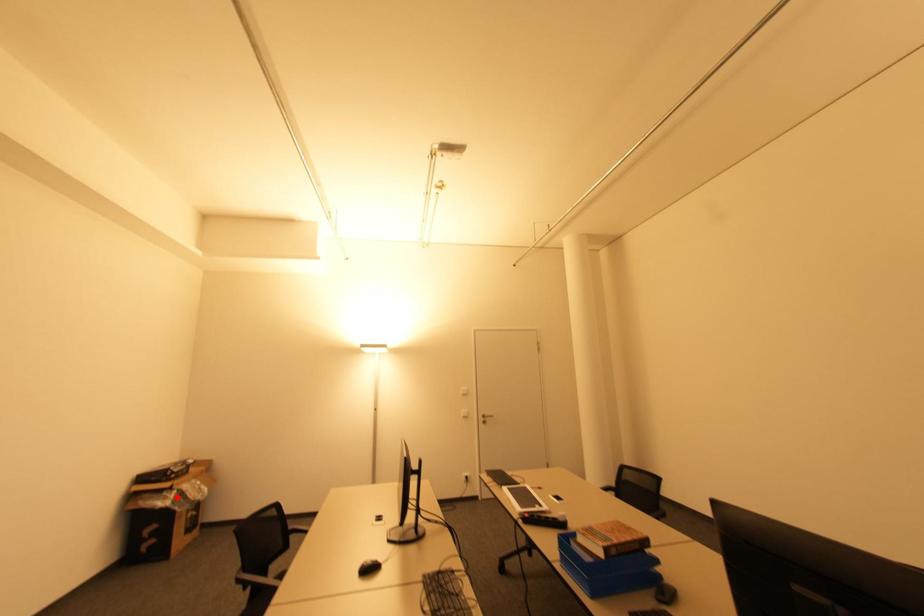
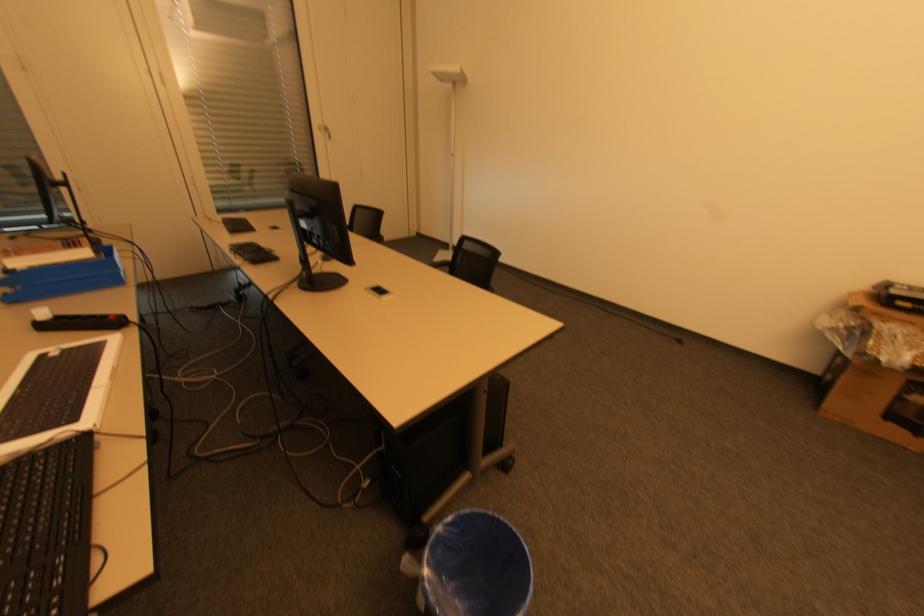
Locate, in the second image, the point that corresponds to the highlighted location in the first image.

(850, 328)